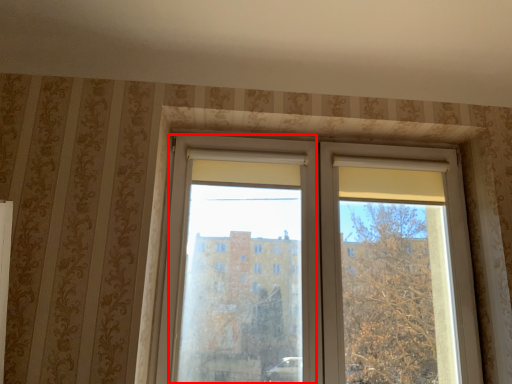
Question: Observing the image, what is the correct spatial positioning of screen door (annotated by the red box) in reference to window?

Choices:
 (A) right
 (B) left

Answer: (B)